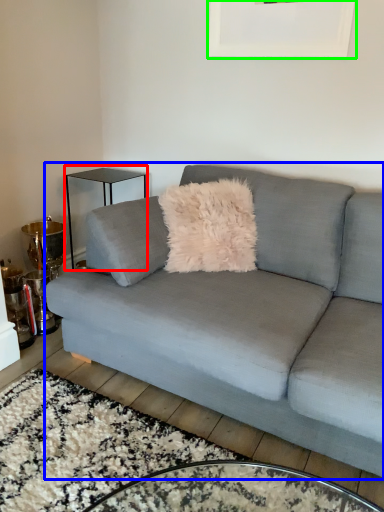
Question: Estimate the real-world distances between objects in this image. Which object is farther from table (highlighted by a red box), studio couch (highlighted by a blue box) or picture frame (highlighted by a green box)?

Choices:
 (A) studio couch
 (B) picture frame

Answer: (A)